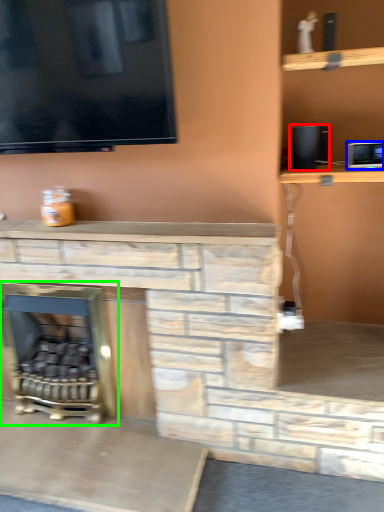
Question: Estimate the real-world distances between objects in this image. Which object is farther from speaker (highlighted by a red box), appliance (highlighted by a blue box) or fireplace (highlighted by a green box)?

Choices:
 (A) appliance
 (B) fireplace

Answer: (B)